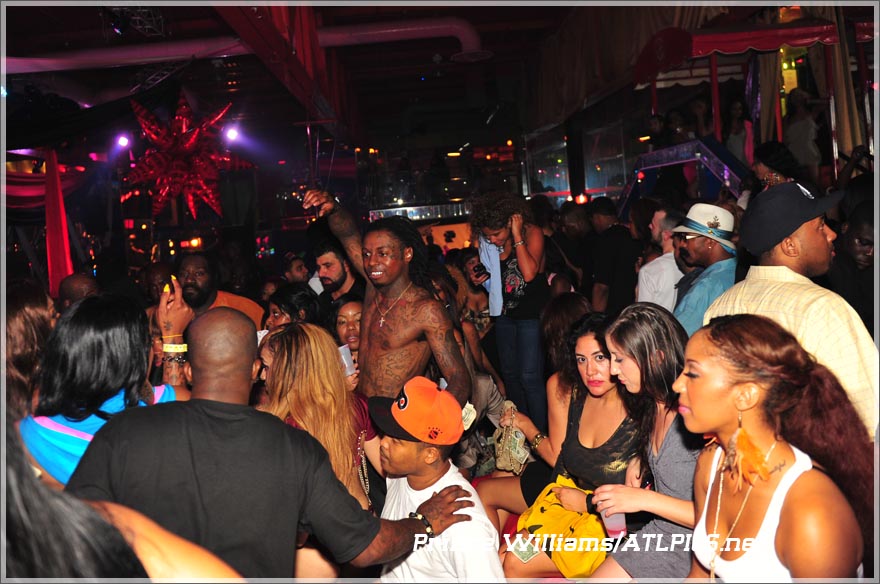
The height and width of the screenshot is (584, 880). I want to click on room entrance, so click(668, 205).